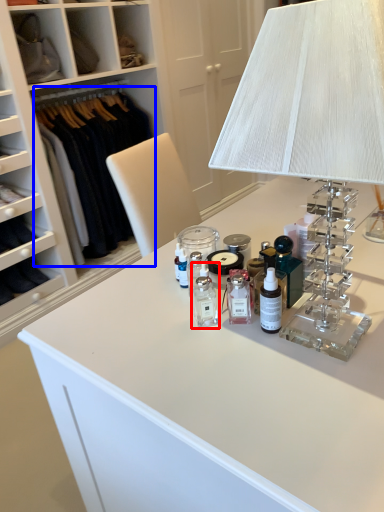
Question: Among these objects, which one is farthest to the camera, toiletry (highlighted by a red box) or clothing (highlighted by a blue box)?

Choices:
 (A) toiletry
 (B) clothing

Answer: (B)